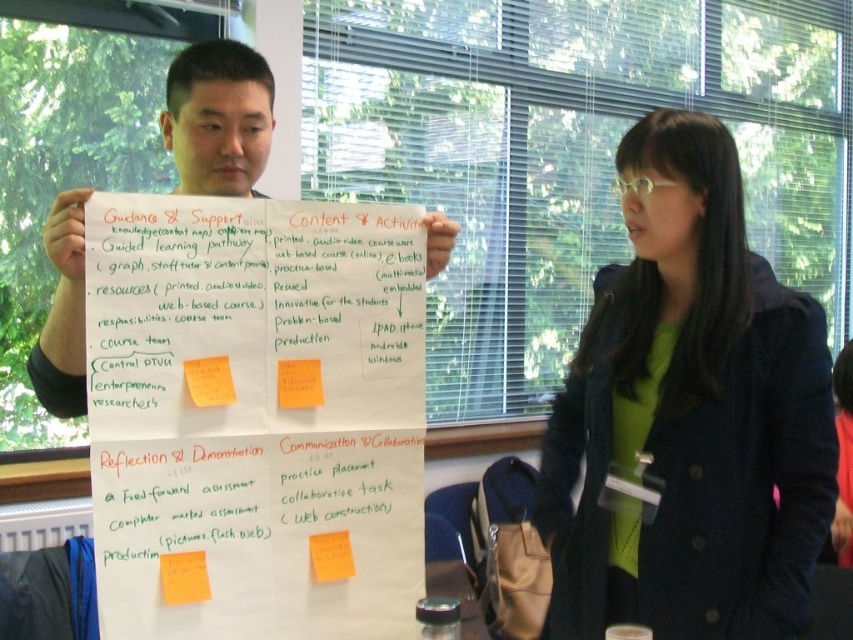
Does white paperboard at center appear on the right side of yellow paper at center?

In fact, white paperboard at center is to the left of yellow paper at center.

Can you confirm if white paperboard at center is smaller than yellow paper at center?

No.

What are the coordinates of `white paperboard at center` in the screenshot? It's located at (218, 116).

Between point (811, 300) and point (216, 385), which one is positioned behind?

Point (811, 300)

Between green matte jacket at center and yellow paper at center, which one has less height?

With less height is yellow paper at center.

Between point (682, 438) and point (192, 396), which one is positioned in front?

Positioned in front is point (192, 396).

I want to click on green matte jacket at center, so click(x=689, y=413).

Is point (692, 365) positioned before point (303, 397)?

No.

Find the location of a particular element. The width and height of the screenshot is (853, 640). green matte jacket at center is located at coordinates click(689, 413).